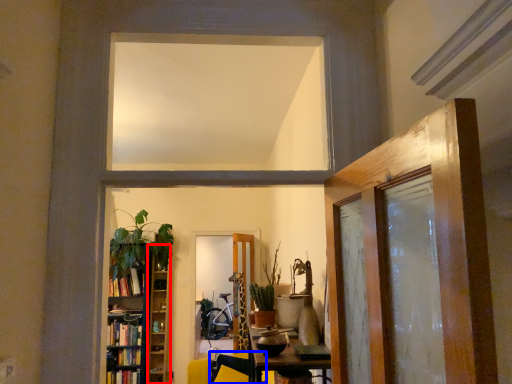
Question: Which object appears farthest to the camera in this image, shelf (highlighted by a red box) or swivel chair (highlighted by a blue box)?

Choices:
 (A) shelf
 (B) swivel chair

Answer: (A)